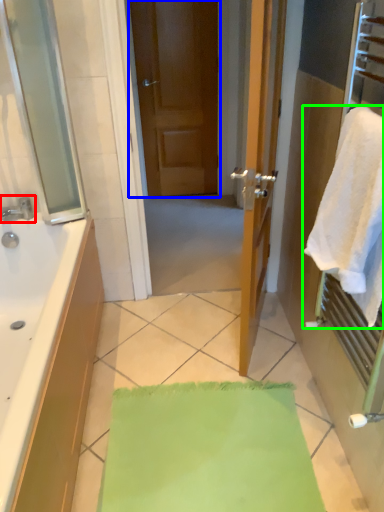
Question: Considering the real-world distances, which object is farthest from tap (highlighted by a red box)? door (highlighted by a blue box) or towel (highlighted by a green box)?

Choices:
 (A) door
 (B) towel

Answer: (A)